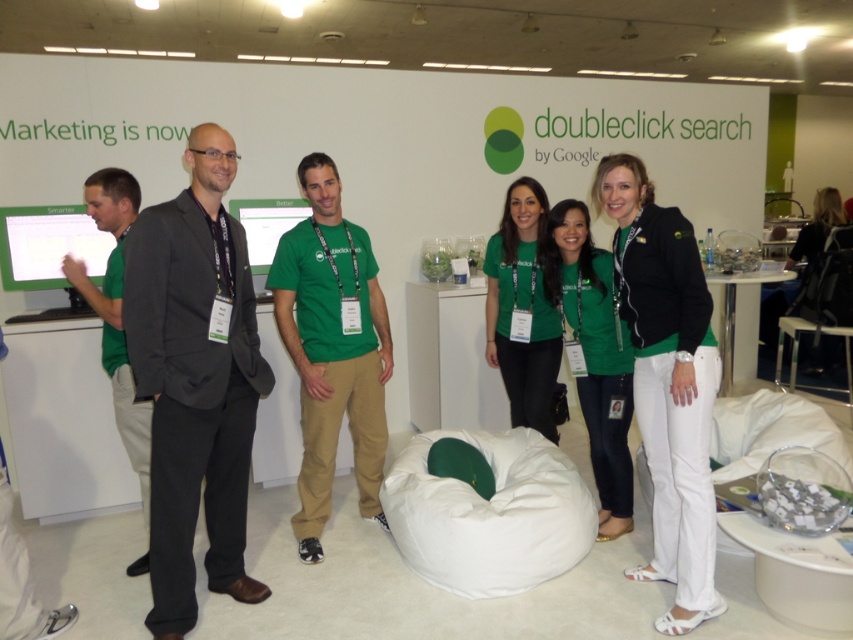
Question: Which object is the farthest from the white fabric bean bag at center?

Choices:
 (A) green fabric jacket at center
 (B) black matte jacket at right
 (C) dark gray suit at center

Answer: (C)

Question: Which point appears farthest from the camera in this image?

Choices:
 (A) (148, 451)
 (B) (444, 508)
 (C) (178, 257)

Answer: (A)

Question: Which point is farther to the camera?

Choices:
 (A) dark gray suit at center
 (B) white fabric bean bag at center
 (C) green fabric jacket at center

Answer: (C)

Question: Can you confirm if white fabric bean bag at center is positioned below green fabric shirt at left?

Choices:
 (A) no
 (B) yes

Answer: (B)

Question: Does black matte jacket at right come behind green fabric shirt at left?

Choices:
 (A) yes
 (B) no

Answer: (B)

Question: Does green cotton t-shirt at center have a lesser width compared to white fabric bean bag at center?

Choices:
 (A) yes
 (B) no

Answer: (A)